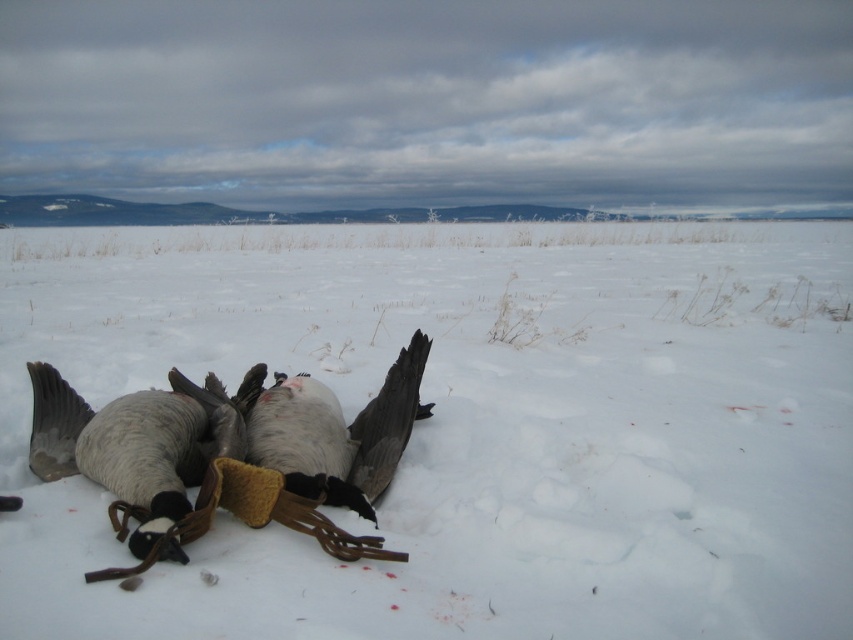
Question: Is gray downy goose at center bigger than white down feathered bird at center?

Choices:
 (A) no
 (B) yes

Answer: (B)

Question: Which point is farther from the camera taking this photo?

Choices:
 (A) 349,493
 (B) 154,518
 (C) 747,340

Answer: (C)

Question: Among these objects, which one is farthest from the camera?

Choices:
 (A) gray downy goose at center
 (B) white down feathered bird at center

Answer: (B)

Question: Is white fluffy snow at center wider than white down feathered bird at center?

Choices:
 (A) no
 (B) yes

Answer: (B)

Question: Can you confirm if gray downy goose at center is bigger than white down feathered bird at center?

Choices:
 (A) no
 (B) yes

Answer: (B)

Question: Which point is closer to the camera taking this photo?

Choices:
 (A) (387, 429)
 (B) (590, 305)
 (C) (80, 417)

Answer: (A)